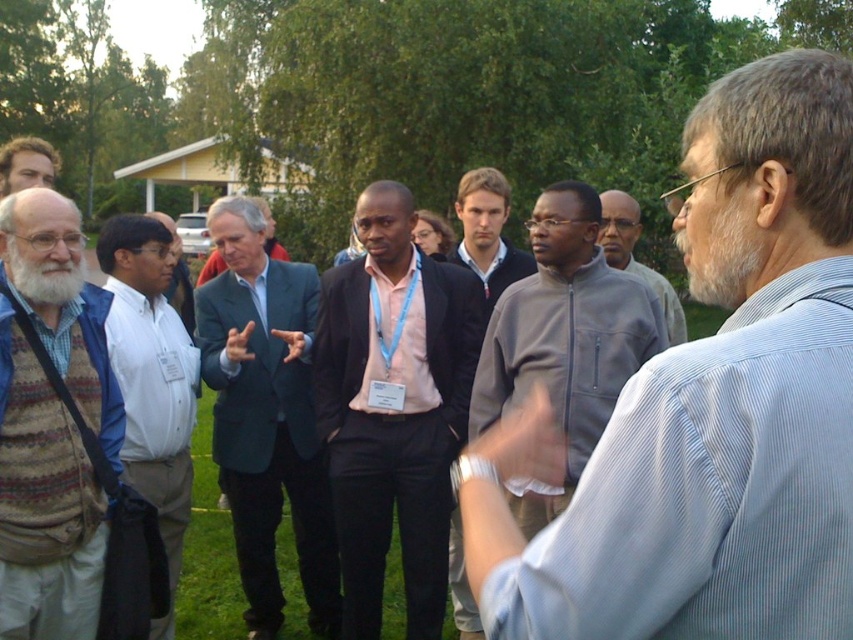
Image resolution: width=853 pixels, height=640 pixels. What do you see at coordinates (393, 408) in the screenshot? I see `pink fabric shirt at center` at bounding box center [393, 408].

Can you confirm if pink fabric shirt at center is wider than gray zip-up jacket at center?

Correct, the width of pink fabric shirt at center exceeds that of gray zip-up jacket at center.

Find the location of a particular element. pink fabric shirt at center is located at coordinates (393, 408).

Where is `pink fabric shirt at center`? The width and height of the screenshot is (853, 640). pink fabric shirt at center is located at coordinates (393, 408).

Does pink fabric shirt at center have a greater height compared to blue fabric suit at center?

In fact, pink fabric shirt at center may be shorter than blue fabric suit at center.

Find the location of a particular element. The width and height of the screenshot is (853, 640). pink fabric shirt at center is located at coordinates (393, 408).

Find the location of a particular element. Image resolution: width=853 pixels, height=640 pixels. pink fabric shirt at center is located at coordinates (393, 408).

Between gray fleece jacket at center and gray zip-up jacket at center, which one is positioned lower?

Positioned lower is gray fleece jacket at center.

The image size is (853, 640). Identify the location of gray fleece jacket at center. (x=564, y=339).

You are a GUI agent. You are given a task and a screenshot of the screen. Output one action in this format:
    pyautogui.click(x=<x>, y=<y>)
    Task: Click on the gray fleece jacket at center
    This screenshot has width=853, height=640.
    Given the screenshot: What is the action you would take?
    pyautogui.click(x=564, y=339)